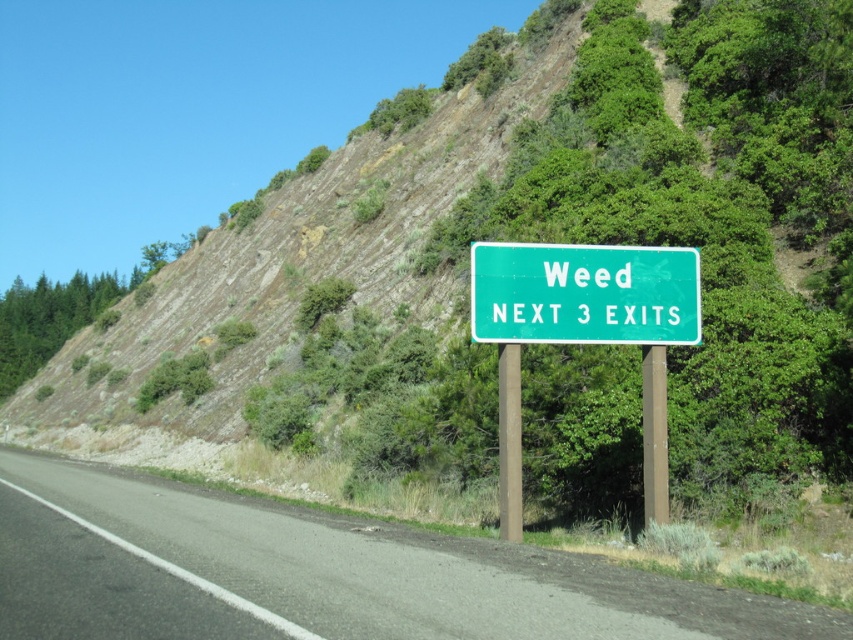
Question: Is asphalt road at center to the right of green metallic sign at center from the viewer's perspective?

Choices:
 (A) yes
 (B) no

Answer: (B)

Question: Which point is farther to the camera?

Choices:
 (A) green metallic sign at center
 (B) asphalt road at center
 (C) green metal sign at center

Answer: (A)

Question: Considering the real-world distances, which object is closest to the green metallic sign at center?

Choices:
 (A) green metal sign at center
 (B) asphalt road at center

Answer: (A)

Question: Which object appears farthest from the camera in this image?

Choices:
 (A) green metallic sign at center
 (B) asphalt road at center
 (C) green metal sign at center

Answer: (A)

Question: Considering the relative positions of asphalt road at center and green metal sign at center in the image provided, where is asphalt road at center located with respect to green metal sign at center?

Choices:
 (A) right
 (B) left

Answer: (B)

Question: Can you confirm if asphalt road at center is bigger than green metal sign at center?

Choices:
 (A) no
 (B) yes

Answer: (B)